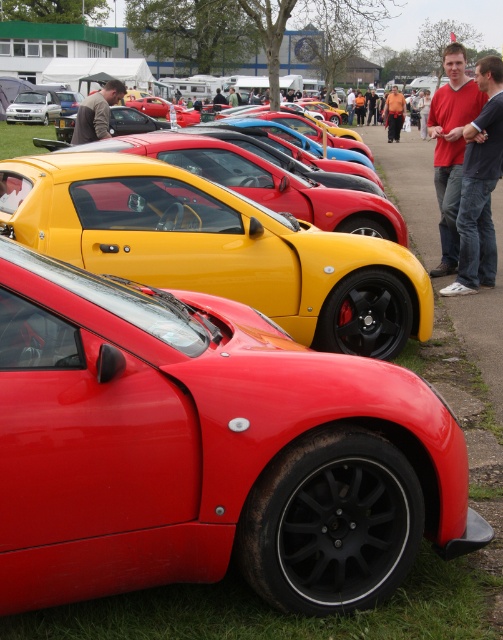
You are a photographer at the car show. You want to take a photo that clearly shows both the glossy red sports car at lower left and the matte red shirt at right. Which object should be closer to the camera to ensure both are in focus?

The glossy red sports car at lower left is in front of the matte red shirt at right. To ensure both are in focus, the photographer should position the camera closer to the glossy red sports car at lower left so that the matte red shirt at right is within the depth of field.

You are a photographer at the car show. You want to take a photo of the glossy red sports car at lower left without the matte silver car at left blocking it. Is there a way to do this by moving your position?

The glossy red sports car at lower left is positioned under the matte silver car at left. To avoid the matte silver car at left blocking the view, you can move to a position where you look downward from above the matte silver car at left, allowing you to capture the glossy red sports car at lower left without obstruction.